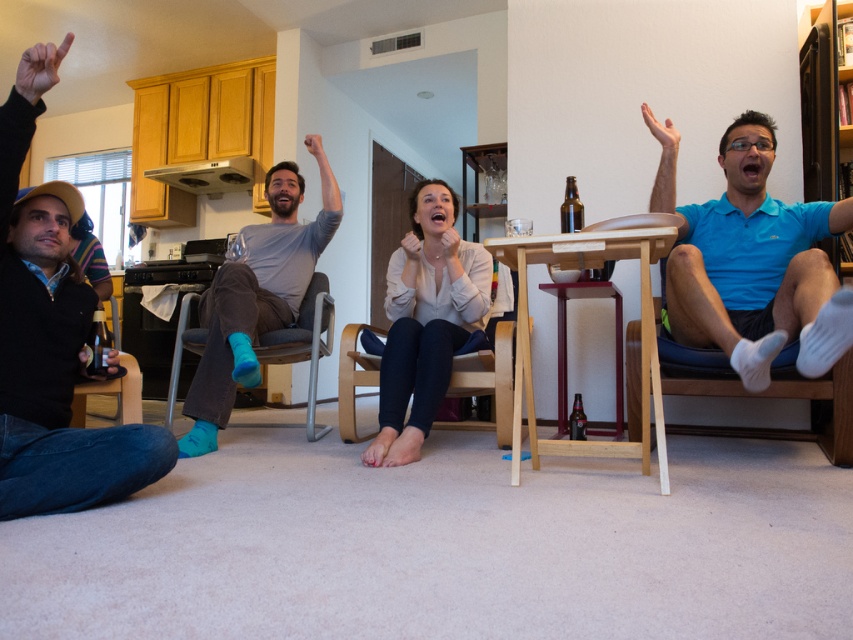
You are a photographer setting up a camera at the center of the room. You want to capture both the blue matte shirt at right and the wooden chair at center in the same frame. Based on their positions, which object should you focus on first to ensure both are in focus?

The blue matte shirt at right is above the wooden chair at center, so you should focus on the wooden chair at center first to ensure both are in focus.

You are standing in the living room and want to find the blue matte shirt at right. According to the coordinates provided, where should you look?

You should look at point (753, 262) to find the blue matte shirt at right.

You are a person who wants to place a small plant pot on the blue fabric chair at right so that it can be seen by the matte skin hand at upper right. Based on the scene description, will the plant pot be visible to the hand?

The blue fabric chair at right is much taller than the matte skin hand at upper right, so the plant pot placed on the blue fabric chair at right would be higher up. This might make it difficult for the matte skin hand at upper right to see the plant pot clearly unless the hand moves closer or adjusts its position.